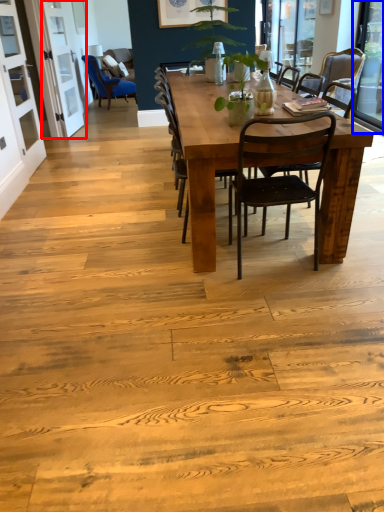
Question: Which of the following is the closest to the observer, screen door (highlighted by a red box) or window screen (highlighted by a blue box)?

Choices:
 (A) screen door
 (B) window screen

Answer: (B)